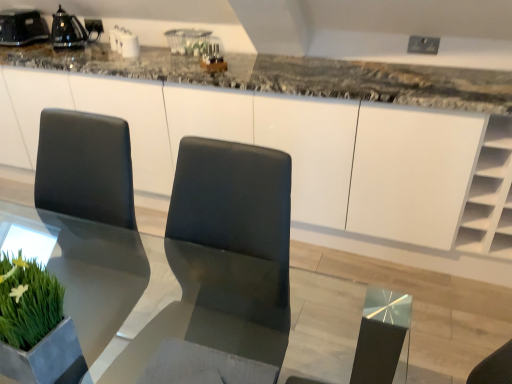
Question: Is transparent glass table at center at the right side of black glossy kettle at upper left, positioned as the 1th appliance in left-to-right order?

Choices:
 (A) yes
 (B) no

Answer: (A)

Question: Is transparent glass table at center positioned with its back to black glossy kettle at upper left, positioned as the 1th appliance in left-to-right order?

Choices:
 (A) no
 (B) yes

Answer: (A)

Question: Is transparent glass table at center bigger than black glossy kettle at upper left, positioned as the 1th appliance in left-to-right order?

Choices:
 (A) yes
 (B) no

Answer: (A)

Question: Is transparent glass table at center shorter than black glossy kettle at upper left, the 2th appliance in the right-to-left sequence?

Choices:
 (A) no
 (B) yes

Answer: (A)

Question: From a real-world perspective, is transparent glass table at center below black glossy kettle at upper left, the 2th appliance in the right-to-left sequence?

Choices:
 (A) yes
 (B) no

Answer: (A)

Question: In terms of width, does black glossy kettle at upper left, the 2th appliance in the right-to-left sequence, look wider or thinner when compared to black glossy kettle at upper left, arranged as the 2th appliance when viewed from the left?

Choices:
 (A) wide
 (B) thin

Answer: (A)

Question: Based on their sizes in the image, would you say black glossy kettle at upper left, the 2th appliance in the right-to-left sequence, is bigger or smaller than black glossy kettle at upper left, arranged as the 2th appliance when viewed from the left?

Choices:
 (A) small
 (B) big

Answer: (B)

Question: From the image's perspective, is black glossy kettle at upper left, positioned as the 1th appliance in left-to-right order, located above or below black glossy kettle at upper left, which is counted as the first appliance, starting from the right?

Choices:
 (A) below
 (B) above

Answer: (B)

Question: Do you think black glossy kettle at upper left, the 2th appliance in the right-to-left sequence, is within black glossy kettle at upper left, arranged as the 2th appliance when viewed from the left, or outside of it?

Choices:
 (A) inside
 (B) outside

Answer: (B)

Question: From their relative heights in the image, would you say transparent glass table at center is taller or shorter than black glossy kettle at upper left, the 2th appliance in the right-to-left sequence?

Choices:
 (A) tall
 (B) short

Answer: (A)

Question: Is transparent glass table at center to the left or to the right of black glossy kettle at upper left, the 2th appliance in the right-to-left sequence, in the image?

Choices:
 (A) right
 (B) left

Answer: (A)

Question: Considering their positions, is transparent glass table at center located in front of or behind black glossy kettle at upper left, positioned as the 1th appliance in left-to-right order?

Choices:
 (A) front
 (B) behind

Answer: (A)

Question: In terms of size, does transparent glass table at center appear bigger or smaller than black glossy kettle at upper left, positioned as the 1th appliance in left-to-right order?

Choices:
 (A) small
 (B) big

Answer: (B)

Question: From a real-world perspective, is black glossy kettle at upper left, arranged as the 2th appliance when viewed from the left, physically located above or below black glossy kettle at upper left, the 2th appliance in the right-to-left sequence?

Choices:
 (A) above
 (B) below

Answer: (B)

Question: Relative to black glossy kettle at upper left, positioned as the 1th appliance in left-to-right order, is black glossy kettle at upper left, which is counted as the first appliance, starting from the right, in front or behind?

Choices:
 (A) behind
 (B) front

Answer: (B)